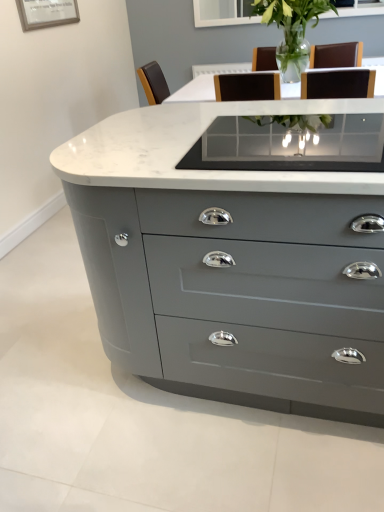
Question: Considering the relative sizes of clear glass vase at center and clear glass table at center in the image provided, is clear glass vase at center taller than clear glass table at center?

Choices:
 (A) yes
 (B) no

Answer: (A)

Question: Considering the relative sizes of clear glass vase at center and clear glass table at center in the image provided, is clear glass vase at center smaller than clear glass table at center?

Choices:
 (A) no
 (B) yes

Answer: (A)

Question: From a real-world perspective, is clear glass vase at center located higher than clear glass table at center?

Choices:
 (A) no
 (B) yes

Answer: (B)

Question: Is the depth of clear glass vase at center less than that of clear glass table at center?

Choices:
 (A) no
 (B) yes

Answer: (A)

Question: Does clear glass vase at center turn towards clear glass table at center?

Choices:
 (A) no
 (B) yes

Answer: (B)

Question: In terms of width, does clear glass table at center look wider or thinner when compared to clear glass vase at center?

Choices:
 (A) thin
 (B) wide

Answer: (A)

Question: In terms of size, does clear glass table at center appear bigger or smaller than clear glass vase at center?

Choices:
 (A) small
 (B) big

Answer: (A)

Question: From a real-world perspective, relative to clear glass vase at center, is clear glass table at center vertically above or below?

Choices:
 (A) above
 (B) below

Answer: (B)

Question: In the image, is clear glass table at center positioned in front of or behind clear glass vase at center?

Choices:
 (A) behind
 (B) front

Answer: (B)

Question: Considering the positions of point (289, 22) and point (183, 161), is point (289, 22) closer or farther from the camera than point (183, 161)?

Choices:
 (A) farther
 (B) closer

Answer: (A)

Question: Looking at the image, does clear glass vase at center seem bigger or smaller compared to clear glass table at center?

Choices:
 (A) big
 (B) small

Answer: (A)

Question: From the image's perspective, relative to clear glass table at center, is clear glass vase at center above or below?

Choices:
 (A) above
 (B) below

Answer: (A)

Question: In the image, is clear glass vase at center on the left side or the right side of clear glass table at center?

Choices:
 (A) right
 (B) left

Answer: (A)

Question: Considering the positions of clear glass table at center and matte gray chest of drawers at center in the image, is clear glass table at center wider or thinner than matte gray chest of drawers at center?

Choices:
 (A) thin
 (B) wide

Answer: (A)

Question: Is clear glass table at center situated inside matte gray chest of drawers at center or outside?

Choices:
 (A) inside
 (B) outside

Answer: (A)